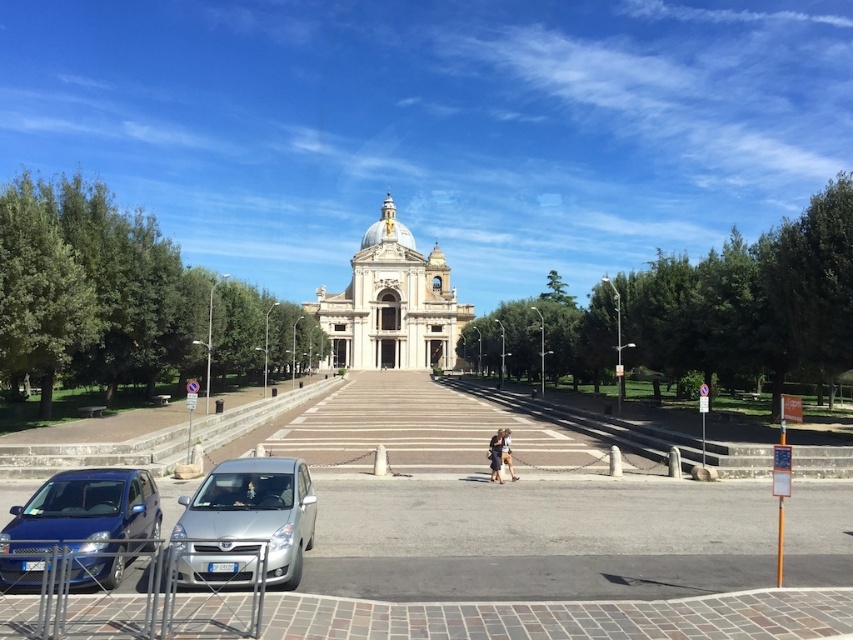
Question: Where is silver metallic car at lower left located in relation to dark brown leather jacket at center in the image?

Choices:
 (A) above
 (B) below

Answer: (B)

Question: Is smooth concrete stairs at center positioned behind metallic blue hatchback at lower left?

Choices:
 (A) no
 (B) yes

Answer: (B)

Question: Can you confirm if white marble church at center is positioned above dark brown leather jacket at center?

Choices:
 (A) yes
 (B) no

Answer: (A)

Question: Estimate the real-world distances between objects in this image. Which object is farther from the dark brown leather jacket at center?

Choices:
 (A) white marble church at center
 (B) smooth concrete stairs at center
 (C) metallic blue hatchback at lower left
 (D) silver metallic car at lower left

Answer: (A)

Question: Which object appears closest to the camera in this image?

Choices:
 (A) smooth concrete stairs at center
 (B) white marble church at center
 (C) metallic blue hatchback at lower left

Answer: (C)

Question: Which of the following is the closest to the observer?

Choices:
 (A) white marble church at center
 (B) silver metallic car at lower left

Answer: (B)